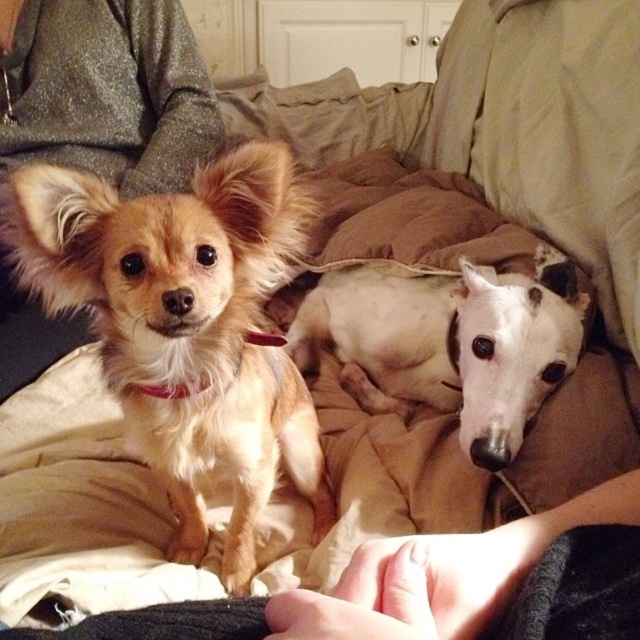
Question: Is fuzzy brown dog at left smaller than white smooth dog at center?

Choices:
 (A) no
 (B) yes

Answer: (A)

Question: Which of the following is the closest to the observer?

Choices:
 (A) white smooth dog at center
 (B) fuzzy brown dog at left

Answer: (B)

Question: Which object is closer to the camera taking this photo?

Choices:
 (A) smooth skin hand at lower center
 (B) white smooth dog at center

Answer: (A)

Question: Which point is farther to the camera?

Choices:
 (A) (282, 280)
 (B) (568, 522)
 (C) (388, 384)

Answer: (A)

Question: Is fuzzy brown dog at left smaller than white smooth dog at center?

Choices:
 (A) no
 (B) yes

Answer: (A)

Question: Can you confirm if fuzzy brown dog at left is thinner than white smooth dog at center?

Choices:
 (A) yes
 (B) no

Answer: (A)